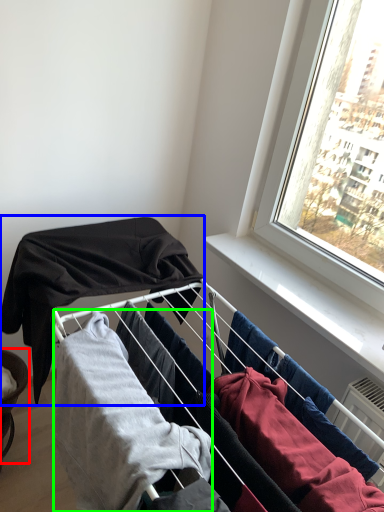
Question: Which object is positioned farthest from furniture (highlighted by a red box)? Select from clothing (highlighted by a blue box) and clothing (highlighted by a green box).

Choices:
 (A) clothing
 (B) clothing

Answer: (B)